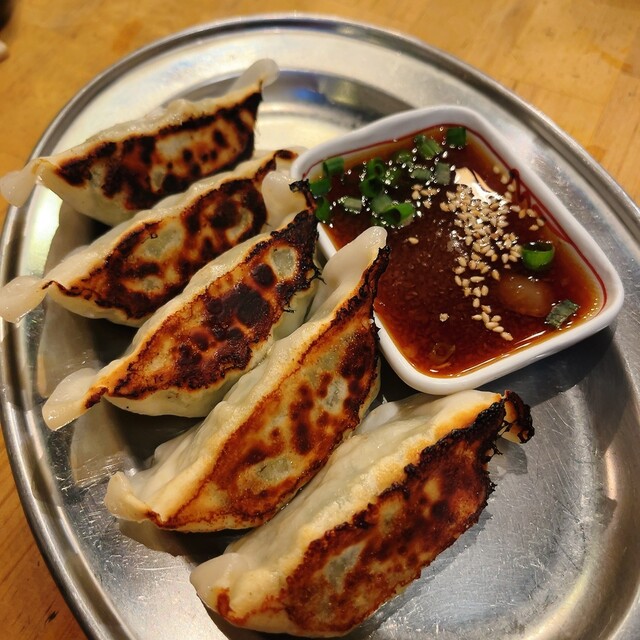
Identify the location of light glares on silver tray. (192, 607), (578, 598), (614, 472), (291, 108), (224, 42), (47, 224).